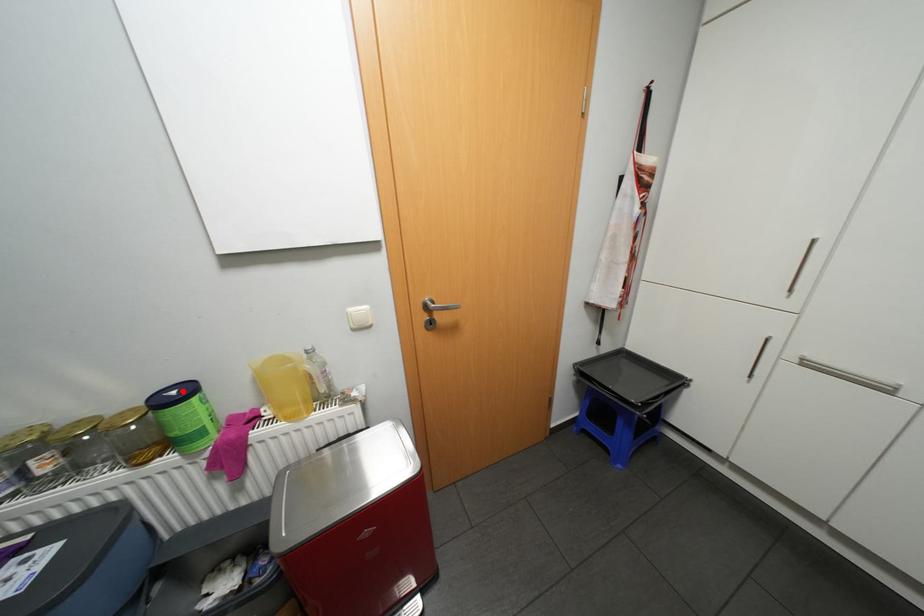
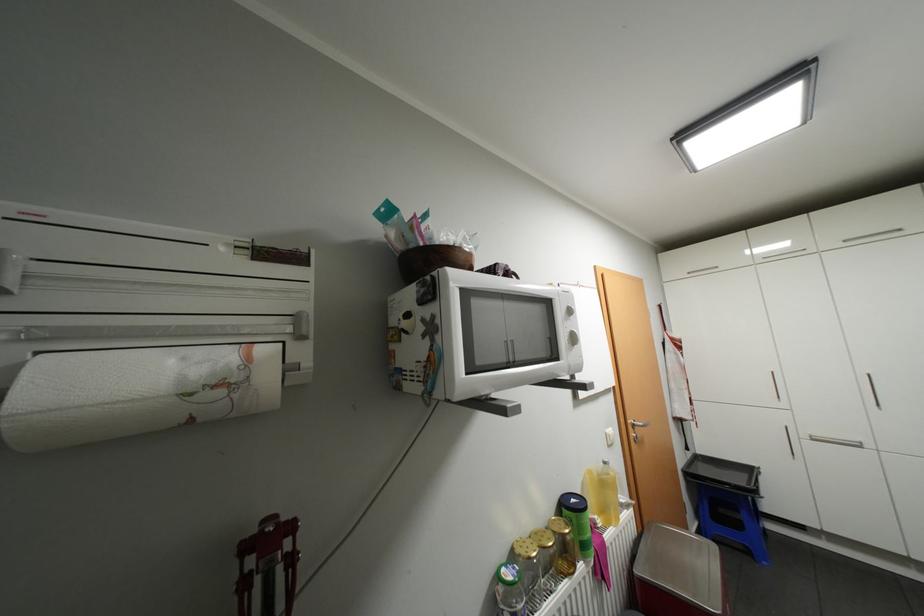
Find the pixel in the second image that matches the highlighted location in the first image.

(580, 499)